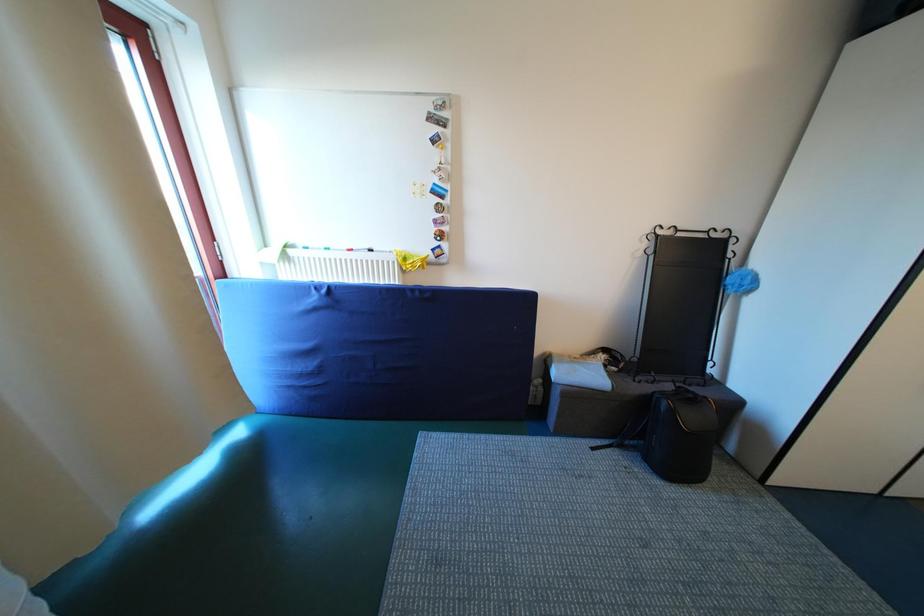
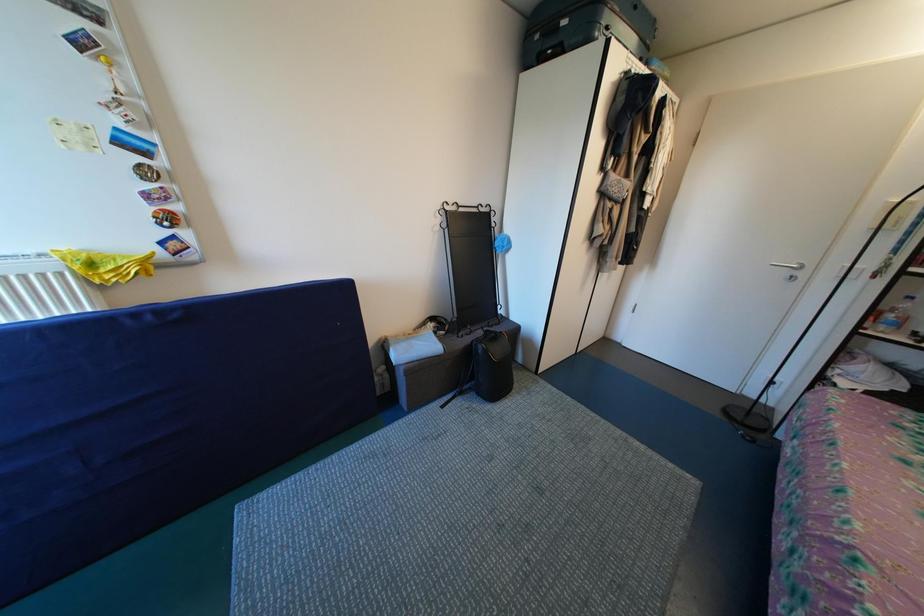
Question: The camera is either moving clockwise (left) or counter-clockwise (right) around the object. The first image is from the beginning of the video and the second image is from the end. Is the camera moving left or right when shooting the video?

Choices:
 (A) Left
 (B) Right

Answer: (A)